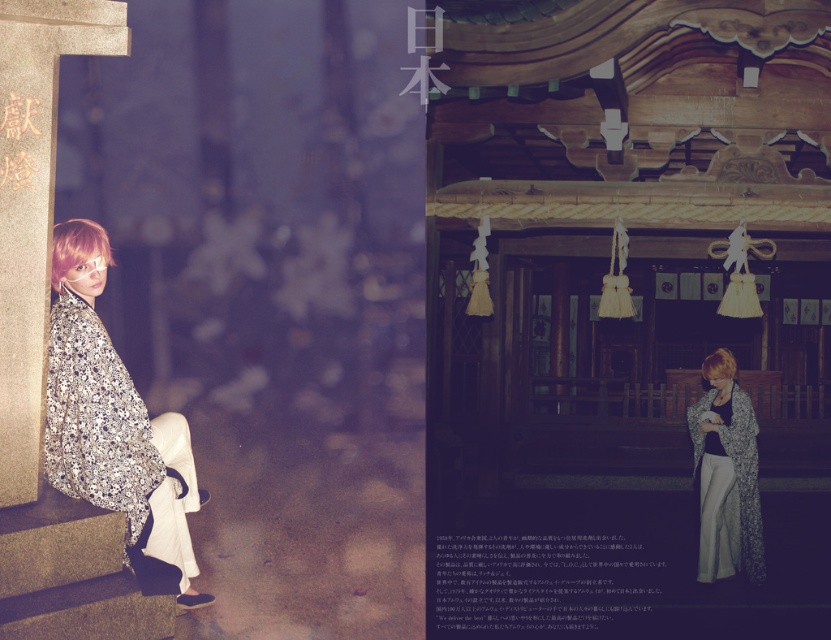
You are standing at the camera position and want to take a photo of the point at coordinates (160, 513). If the camera has a focal length of 50mm and the sensor size is 36mm wide, what is the horizontal distance in feet between you and the point?

The point at coordinates (160, 513) is 19.62 feet from the camera, so the horizontal distance is 19.62 feet.

You are an artist who wants to paint the scene. You notice the silver metallic kimono at left and the black paper at lower center. Which object should you draw first if you want to paint the taller object first?

The silver metallic kimono at left is taller than the black paper at lower center, so you should draw the silver metallic kimono at left first.